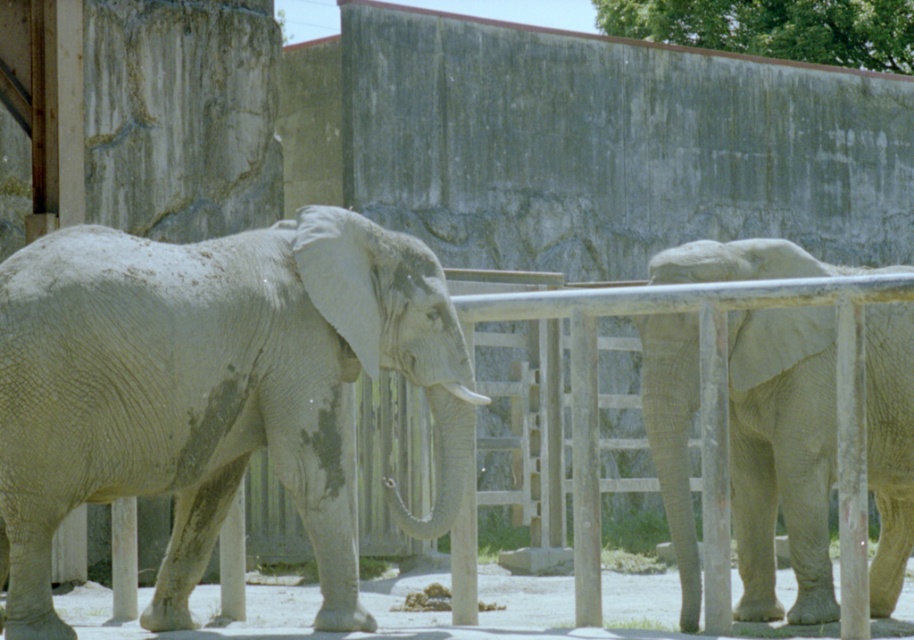
Question: Does gray textured elephant at center lie behind gray textured elephant at right?

Choices:
 (A) yes
 (B) no

Answer: (B)

Question: Considering the relative positions of gray textured elephant at center and gray textured elephant at right in the image provided, where is gray textured elephant at center located with respect to gray textured elephant at right?

Choices:
 (A) right
 (B) left

Answer: (B)

Question: Does gray textured elephant at center appear over gray textured elephant at right?

Choices:
 (A) no
 (B) yes

Answer: (B)

Question: Which point is closer to the camera taking this photo?

Choices:
 (A) (684, 605)
 (B) (267, 404)

Answer: (B)

Question: Which point appears closest to the camera in this image?

Choices:
 (A) 444,460
 (B) 663,433

Answer: (A)